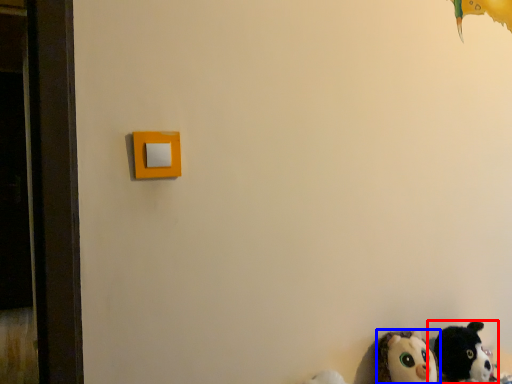
Question: Which of the following is the closest to the observer, toy (highlighted by a red box) or toy (highlighted by a blue box)?

Choices:
 (A) toy
 (B) toy

Answer: (B)